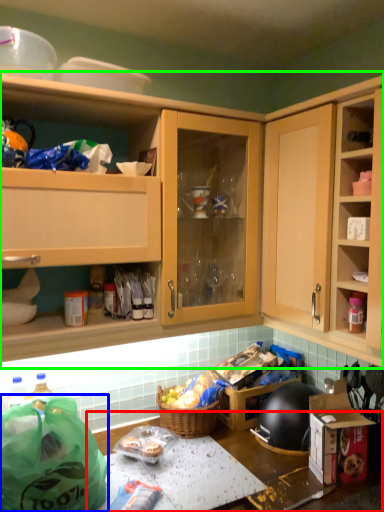
Question: Which object is the closest to the table (highlighted by a red box)? Choose among these: bag (highlighted by a blue box) or cabinetry (highlighted by a green box).

Choices:
 (A) bag
 (B) cabinetry

Answer: (A)